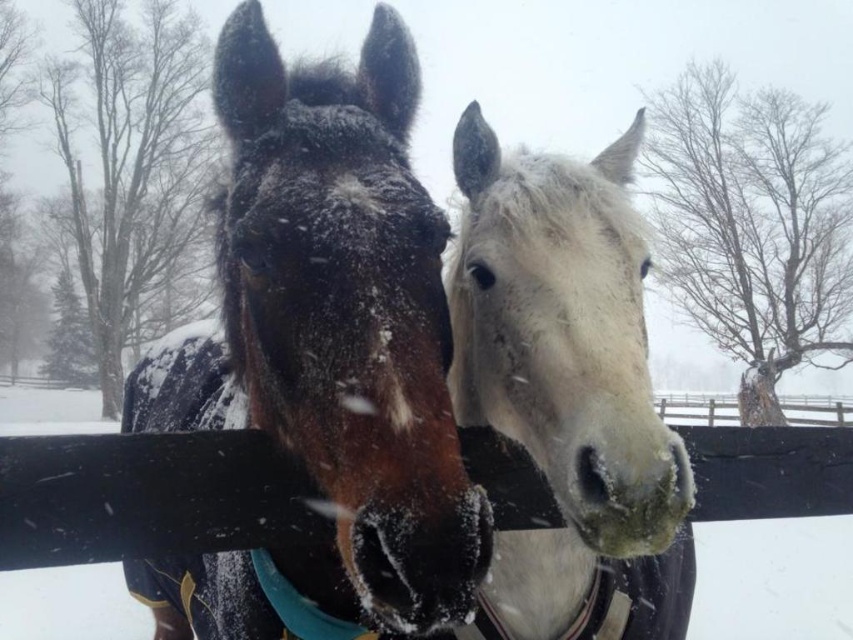
You are standing in front of the wooden fence and want to pet the horses. Which horse, the shiny brown horse at center or the white matte horse at center, can you reach first without moving your position?

The shiny brown horse at center is closer to the viewer than the white matte horse at center, so you can reach the shiny brown horse at center first without moving.

You are standing in the snowy field and want to approach the shiny brown horse at center. If your maximum comfortable reaching distance is 1 meter, can you touch the horse without moving closer?

The shiny brown horse at center is 95.81 centimeters away from the viewer. Since your maximum comfortable reaching distance is 1 meter, you can touch the horse without moving closer because 95.81 cm is within the 1 meter limit.

You are a farmer who needs to fit both the shiny brown horse at center and the white matte horse at center into a stable that can only accommodate one horse at a time. Based on their sizes, which horse would require more space in the stable?

The shiny brown horse at center might be wider than the white matte horse at center, so it would require more space in the stable.